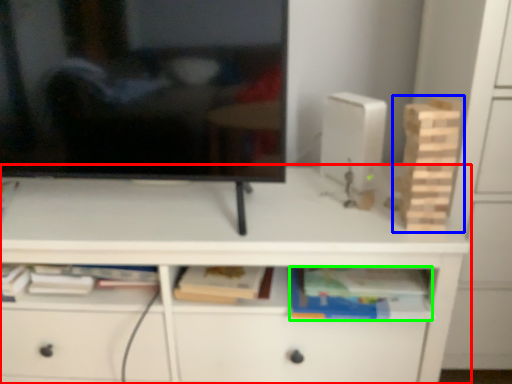
Question: Which is nearer to the desk (highlighted by a red box)? toy (highlighted by a blue box) or book (highlighted by a green box).

Choices:
 (A) toy
 (B) book

Answer: (B)